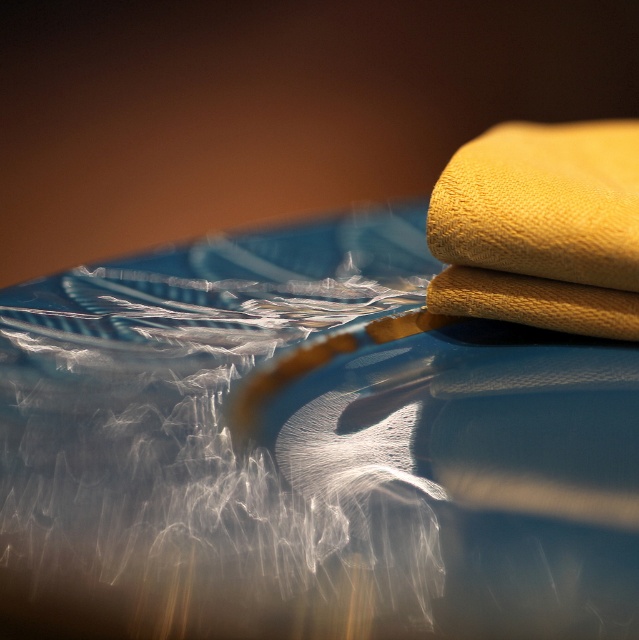
Question: Which of the following is the closest to the observer?

Choices:
 (A) yellow fabric at upper right
 (B) translucent plastic bag at center

Answer: (B)

Question: From the image, what is the correct spatial relationship of translucent plastic bag at center in relation to yellow fabric at upper right?

Choices:
 (A) above
 (B) below

Answer: (B)

Question: Which point appears farthest from the camera in this image?

Choices:
 (A) (578, 172)
 (B) (36, 451)

Answer: (A)

Question: Is translucent plastic bag at center wider than yellow fabric at upper right?

Choices:
 (A) no
 (B) yes

Answer: (B)

Question: Is translucent plastic bag at center wider than yellow fabric at upper right?

Choices:
 (A) yes
 (B) no

Answer: (A)